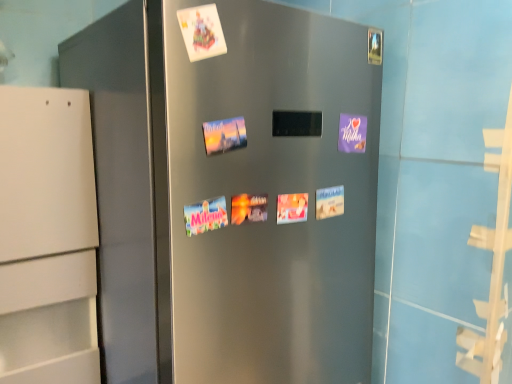
Question: Can white paper at upper center be found inside white paper postcard at center, acting as the 1th postcard starting from the bottom?

Choices:
 (A) yes
 (B) no

Answer: (B)

Question: Is white paper postcard at center, which is the 2th postcard in top-to-bottom order, smaller than white paper at upper center?

Choices:
 (A) yes
 (B) no

Answer: (A)

Question: Are white paper postcard at center, which is the 2th postcard in top-to-bottom order, and white paper at upper center located far from each other?

Choices:
 (A) yes
 (B) no

Answer: (B)

Question: From a real-world perspective, does white paper postcard at center, acting as the 1th postcard starting from the bottom, stand above white paper at upper center?

Choices:
 (A) yes
 (B) no

Answer: (B)

Question: Considering the relative sizes of white paper postcard at center, acting as the 1th postcard starting from the bottom, and white paper at upper center in the image provided, is white paper postcard at center, acting as the 1th postcard starting from the bottom, bigger than white paper at upper center?

Choices:
 (A) yes
 (B) no

Answer: (B)

Question: From a real-world perspective, is white paper postcard at center, which is the 2th postcard in top-to-bottom order, located beneath white paper at upper center?

Choices:
 (A) no
 (B) yes

Answer: (B)

Question: From a real-world perspective, does purple matte postcard at upper right, the 2th postcard positioned from the bottom, stand above white paper postcard at center, which is the 2th postcard in top-to-bottom order?

Choices:
 (A) yes
 (B) no

Answer: (A)

Question: Does purple matte postcard at upper right, the 2th postcard positioned from the bottom, have a lesser height compared to white paper postcard at center, which is the 2th postcard in top-to-bottom order?

Choices:
 (A) yes
 (B) no

Answer: (B)

Question: Is purple matte postcard at upper right, the 2th postcard positioned from the bottom, directly adjacent to white paper postcard at center, acting as the 1th postcard starting from the bottom?

Choices:
 (A) no
 (B) yes

Answer: (A)

Question: Is white paper postcard at center, which is the 2th postcard in top-to-bottom order, completely or partially inside purple matte postcard at upper right, the 2th postcard positioned from the bottom?

Choices:
 (A) yes
 (B) no

Answer: (B)

Question: Is purple matte postcard at upper right, the 2th postcard positioned from the bottom, to the left of white paper postcard at center, acting as the 1th postcard starting from the bottom, from the viewer's perspective?

Choices:
 (A) no
 (B) yes

Answer: (A)

Question: From the image's perspective, is purple matte postcard at upper right, the 2th postcard positioned from the bottom, over white paper postcard at center, acting as the 1th postcard starting from the bottom?

Choices:
 (A) yes
 (B) no

Answer: (A)

Question: Is white paper at upper center in contact with white paper postcard at center, which is the 2th postcard in top-to-bottom order?

Choices:
 (A) no
 (B) yes

Answer: (A)